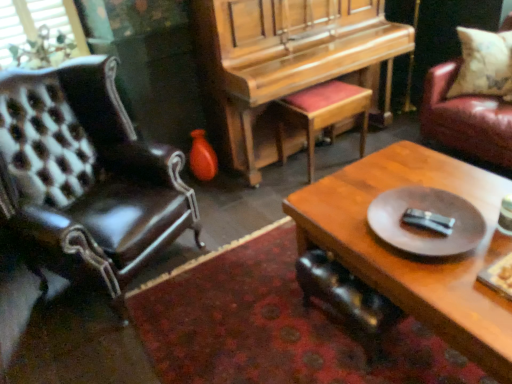
Locate an element on the screen. The width and height of the screenshot is (512, 384). free spot above shiny black leather chair at lower center, marked as the 1th chair in a right-to-left arrangement (from a real-world perspective) is located at coordinates (347, 283).